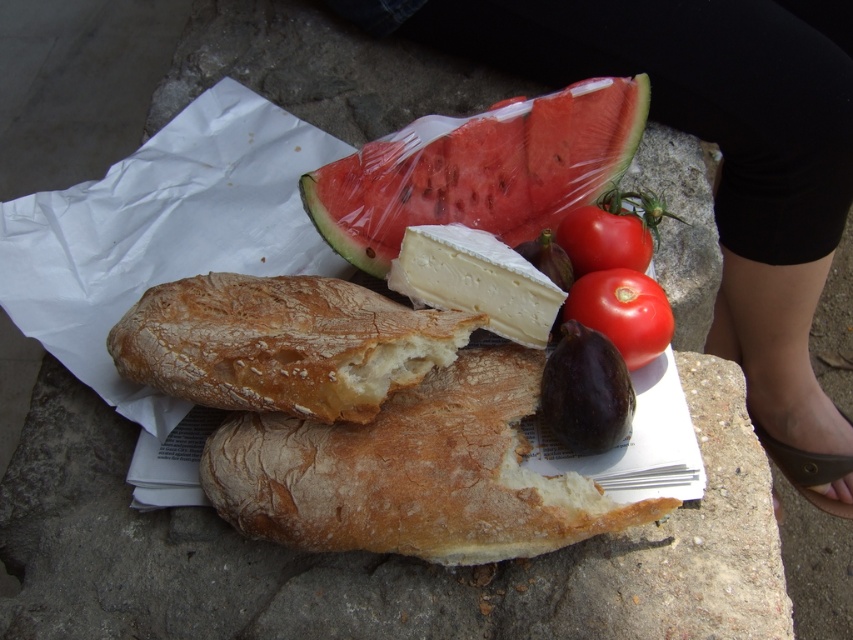
Question: Is brown crusty bread at center to the right of shiny red tomato at center from the viewer's perspective?

Choices:
 (A) yes
 (B) no

Answer: (B)

Question: Which object is farther from the camera taking this photo?

Choices:
 (A) purple matte eggplant at center
 (B) brown crusty bread at center
 (C) red translucent watermelon at upper center
 (D) red matte tomato at center

Answer: (C)

Question: Can you confirm if golden brown crusty bread at center is positioned above shiny red tomato at center?

Choices:
 (A) no
 (B) yes

Answer: (A)

Question: Is golden brown crusty bread at center smaller than brown crusty bread at center?

Choices:
 (A) no
 (B) yes

Answer: (A)

Question: Which of the following is the closest to the observer?

Choices:
 (A) (759, 262)
 (B) (347, 392)
 (C) (596, 256)
 (D) (553, 252)

Answer: (B)

Question: Which object appears farthest from the camera in this image?

Choices:
 (A) purple matte eggplant at center
 (B) black fabric leg at upper center
 (C) red matte tomato at center

Answer: (B)